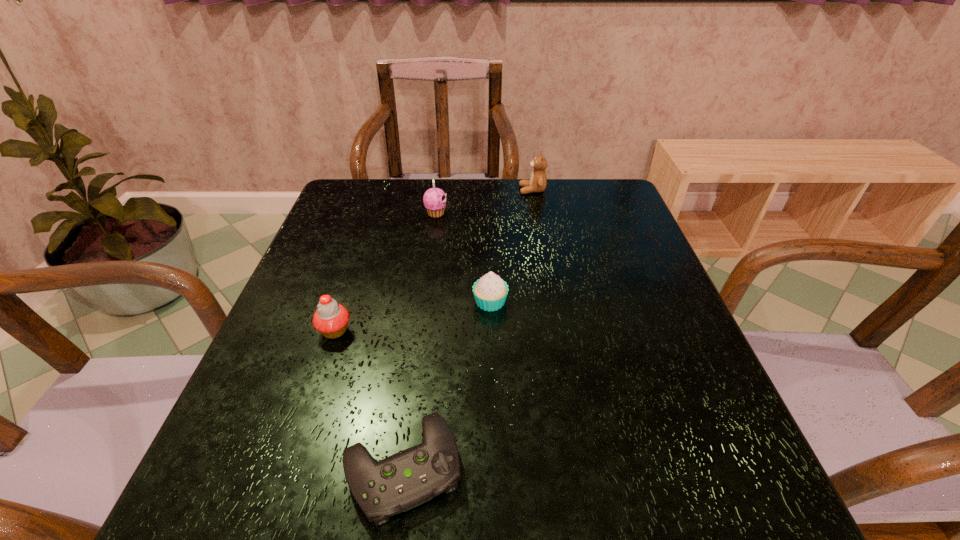
Identify the location of vacant region between the second farthest object and the leftmost object. This screenshot has width=960, height=540. (385, 272).

This screenshot has width=960, height=540. I want to click on free point between the teddy bear and the rightmost cupcake, so click(x=512, y=246).

At what (x,y) coordinates should I click in order to perform the action: click on free point between the fourth farthest object and the second object from right to left. Please return your answer as a coordinate pair (x, y). The height and width of the screenshot is (540, 960). Looking at the image, I should click on (413, 316).

I want to click on vacant area that lies between the second farthest object and the control, so click(420, 340).

The width and height of the screenshot is (960, 540). Identify the location of blank region between the nearest cupcake and the farthest object. (434, 260).

This screenshot has height=540, width=960. Identify the location of vacant space that is in between the leftmost cupcake and the second object from right to left. (413, 316).

Identify the location of free spot between the second object from right to left and the fourth farthest object. (413, 316).

Where is `vacant space that's between the farthest cupcake and the nearest cupcake`? vacant space that's between the farthest cupcake and the nearest cupcake is located at coordinates (385, 272).

Locate which object is the third closest to the rightmost cupcake. Please provide its 2D coordinates. Your answer should be formatted as a tuple, i.e. [(x, y)], where the tuple contains the x and y coordinates of a point satisfying the conditions above.

[(434, 199)]

Locate an element on the screen. The image size is (960, 540). the closest object to the rightmost cupcake is located at coordinates (409, 478).